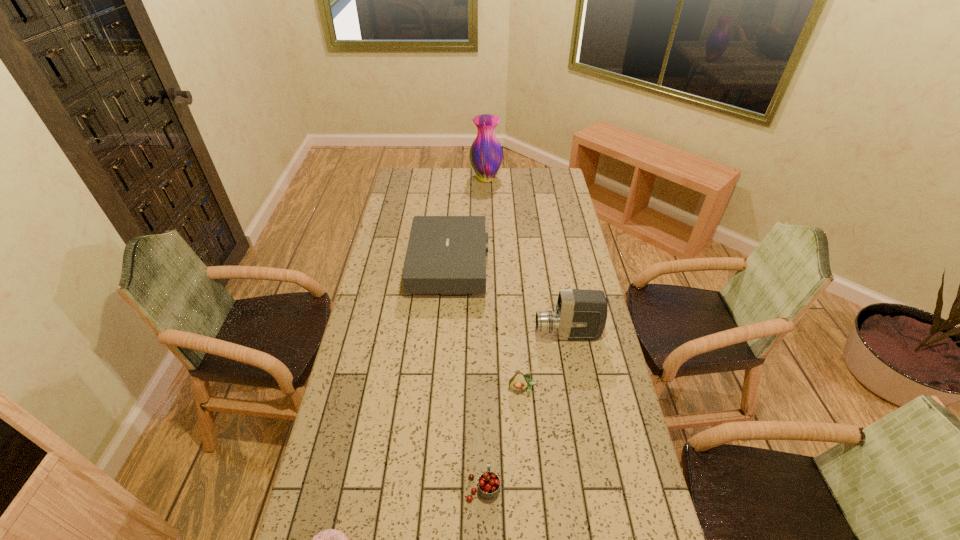
At what (x,y) coordinates should I click in order to perform the action: click on object that stands as the closest to the avocado. Please return your answer as a coordinate pair (x, y). The width and height of the screenshot is (960, 540). Looking at the image, I should click on (580, 315).

The width and height of the screenshot is (960, 540). I want to click on object that ranks as the closest to the avocado, so click(x=580, y=315).

Identify the location of vacant space that satisfies the following two spatial constraints: 1. on the handle side of the fifth farthest object; 2. on the front-facing side of the projector. This screenshot has width=960, height=540. (482, 266).

Where is `free space that satisfies the following two spatial constraints: 1. on the front-facing side of the second farthest object; 2. on the handle side of the cherry`? Image resolution: width=960 pixels, height=540 pixels. free space that satisfies the following two spatial constraints: 1. on the front-facing side of the second farthest object; 2. on the handle side of the cherry is located at coordinates (434, 486).

Identify the location of vacant space that satisfies the following two spatial constraints: 1. on the front side of the vase; 2. on the front-facing side of the fifth nearest object. This screenshot has width=960, height=540. (488, 266).

Where is `free space that satisfies the following two spatial constraints: 1. on the handle side of the second nearest object; 2. on the front-facing side of the fifth nearest object`? The width and height of the screenshot is (960, 540). free space that satisfies the following two spatial constraints: 1. on the handle side of the second nearest object; 2. on the front-facing side of the fifth nearest object is located at coordinates (x=482, y=266).

Identify the location of free space in the image that satisfies the following two spatial constraints: 1. on the handle side of the second nearest object; 2. on the left side of the vase. (482, 179).

Locate an element on the screen. free space that satisfies the following two spatial constraints: 1. on the handle side of the second nearest object; 2. on the right side of the farthest object is located at coordinates (482, 179).